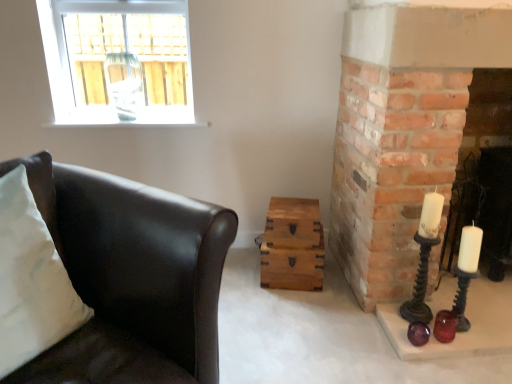
Question: Is smooth brick fireplace at right closer to camera compared to matte black candle holder at right, which appears as the first candle holder when viewed from the top?

Choices:
 (A) no
 (B) yes

Answer: (A)

Question: Is smooth brick fireplace at right outside of matte black candle holder at right, which is the 2th candle holder from bottom to top?

Choices:
 (A) yes
 (B) no

Answer: (A)

Question: Is smooth brick fireplace at right smaller than matte black candle holder at right, which is the 2th candle holder from bottom to top?

Choices:
 (A) no
 (B) yes

Answer: (A)

Question: Considering the relative sizes of smooth brick fireplace at right and matte black candle holder at right, which appears as the first candle holder when viewed from the top, in the image provided, is smooth brick fireplace at right thinner than matte black candle holder at right, which appears as the first candle holder when viewed from the top,?

Choices:
 (A) no
 (B) yes

Answer: (A)

Question: From a real-world perspective, is smooth brick fireplace at right physically above matte black candle holder at right, which is the 2th candle holder from bottom to top?

Choices:
 (A) yes
 (B) no

Answer: (A)

Question: In terms of width, does smooth brick fireplace at right look wider or thinner when compared to wooden chest at center, the 2th drawer viewed from the top?

Choices:
 (A) thin
 (B) wide

Answer: (B)

Question: Is smooth brick fireplace at right taller or shorter than wooden chest at center, the 1th drawer in the bottom-to-top sequence?

Choices:
 (A) short
 (B) tall

Answer: (B)

Question: From a real-world perspective, is smooth brick fireplace at right positioned above or below wooden chest at center, the 2th drawer viewed from the top?

Choices:
 (A) above
 (B) below

Answer: (A)

Question: Is point (490, 192) closer or farther from the camera than point (266, 256)?

Choices:
 (A) farther
 (B) closer

Answer: (A)

Question: From the image's perspective, is white soft cushion at left located above or below wooden chest at center, the 1th drawer in the bottom-to-top sequence?

Choices:
 (A) above
 (B) below

Answer: (A)

Question: Which is correct: white soft cushion at left is inside wooden chest at center, the 1th drawer in the bottom-to-top sequence, or outside of it?

Choices:
 (A) outside
 (B) inside

Answer: (A)

Question: From a real-world perspective, is white soft cushion at left physically located above or below wooden chest at center, the 2th drawer viewed from the top?

Choices:
 (A) below
 (B) above

Answer: (B)

Question: Considering the positions of white soft cushion at left and wooden chest at center, the 1th drawer in the bottom-to-top sequence, in the image, is white soft cushion at left taller or shorter than wooden chest at center, the 1th drawer in the bottom-to-top sequence,?

Choices:
 (A) tall
 (B) short

Answer: (A)

Question: Looking at the image, does wooden chest at center, the 2th drawer in the bottom-to-top sequence, seem bigger or smaller compared to matte black candle holder at right, which appears as the first candle holder when viewed from the top?

Choices:
 (A) big
 (B) small

Answer: (A)

Question: In the image, is wooden chest at center, the 1th drawer viewed from the top, on the left side or the right side of matte black candle holder at right, which is the 2th candle holder from bottom to top?

Choices:
 (A) left
 (B) right

Answer: (A)